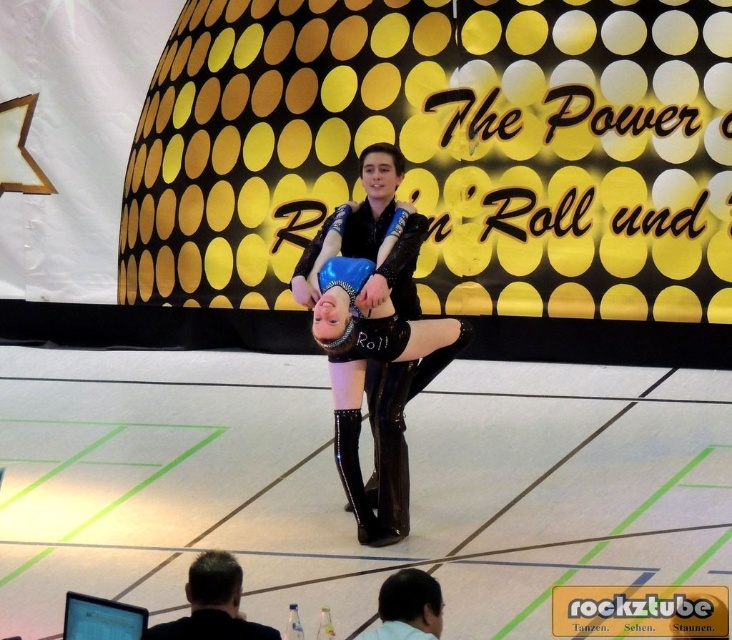
What are the coordinates of the glossy blue dress at center?

The glossy blue dress at center is located at point (376, 339).

You are a photographer standing in front of the stage. You want to capture a photo of the performers where the glossy blue dress at center and the black leather boot at center are clearly visible. Given that your camera has a depth of field that can focus on objects within 20 inches of each other, will both objects be in focus?

The glossy blue dress at center is 20.29 inches from the black leather boot at center. Since the distance between them exceeds the camera lens depth of field of 20 inches, the two objects may not both be in focus simultaneously.